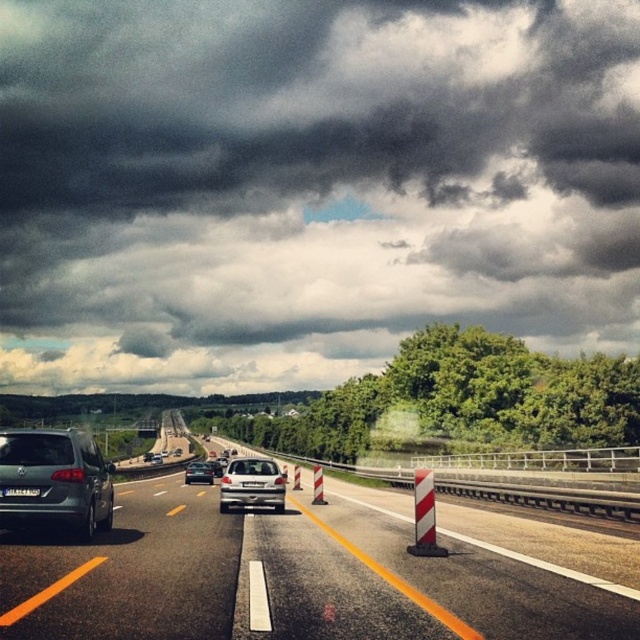
Question: Can you confirm if dark gray cloud at upper center is smaller than satin silver van at center-left?

Choices:
 (A) yes
 (B) no

Answer: (B)

Question: Is metallic silver car at center further to camera compared to satin silver sedan at center?

Choices:
 (A) no
 (B) yes

Answer: (A)

Question: Among these points, which one is farthest from the camera?

Choices:
 (A) (72, 520)
 (B) (184, 481)
 (C) (273, 490)

Answer: (B)

Question: From the image, what is the correct spatial relationship of dark gray cloud at upper center in relation to satin silver sedan at center?

Choices:
 (A) above
 (B) below

Answer: (A)

Question: Which object is positioned closest to the satin silver van at center-left?

Choices:
 (A) metallic silver car at center
 (B) dark gray cloud at upper center
 (C) satin silver sedan at center
 (D) satin silver hatchback at center

Answer: (D)

Question: Which of these objects is positioned closest to the metallic silver car at center?

Choices:
 (A) satin silver van at center-left
 (B) satin silver sedan at center

Answer: (A)